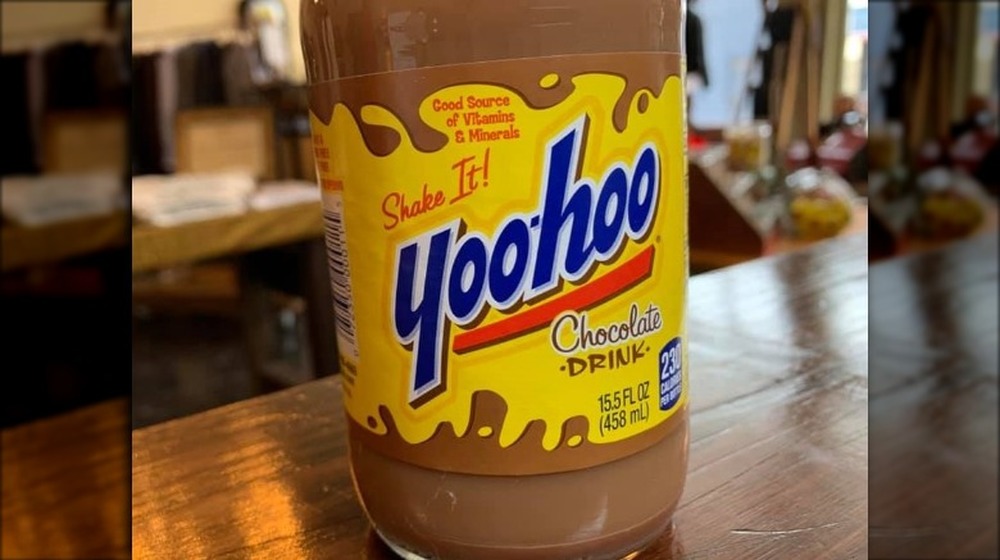
The width and height of the screenshot is (1000, 560). What are the coordinates of `chair` in the screenshot? It's located at (224, 140).